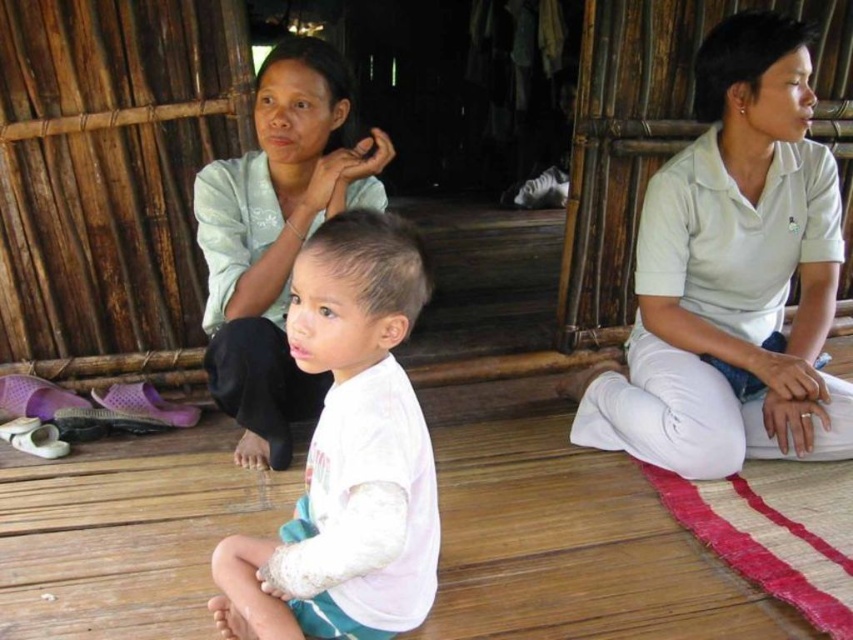
You are trying to decide which shirt to wear for an outdoor event. You see both the white cotton shirt at center and the matte light green blouse at center in the image. Which one is covering the other?

The white cotton shirt at center is positioned over the matte light green blouse at center, so it is covering the blouse.

Based on the scene description, which object is located at the coordinates point (730, 275)?

The point (730, 275) corresponds to the white cotton shirt at center.